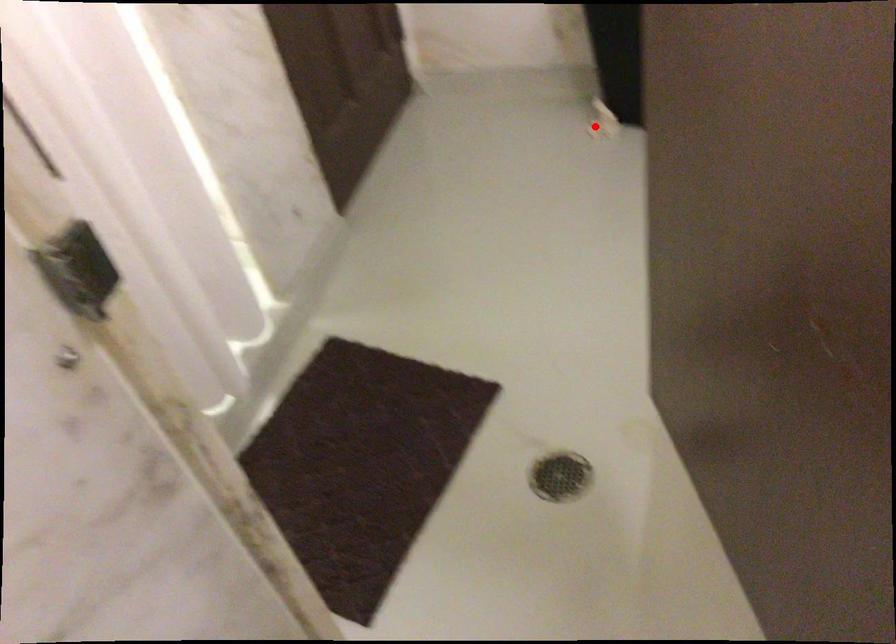
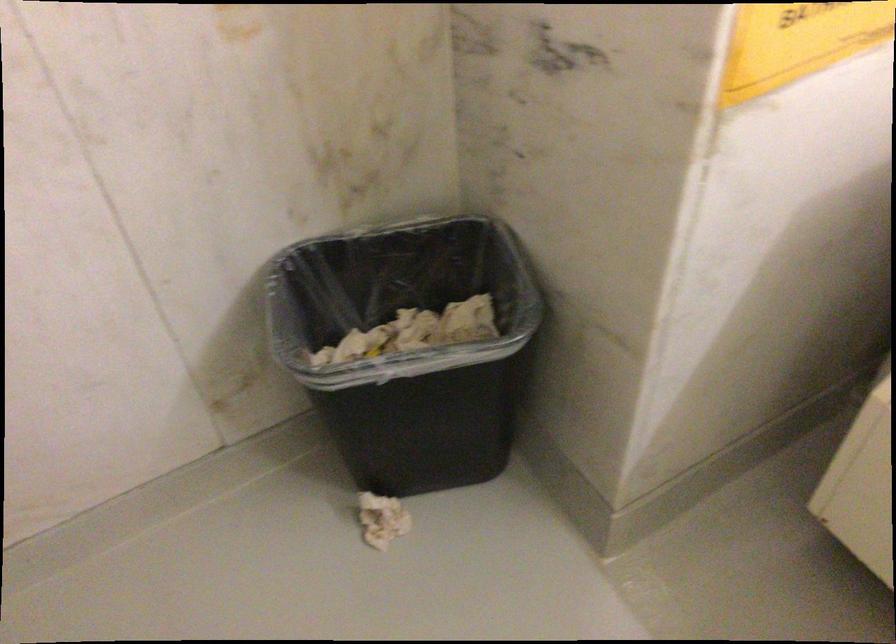
Question: I am providing you with two images of the same scene from different viewpoints. A red point is shown in image1. For the corresponding object point in image2, is it positioned nearer or farther from the camera?

Choices:
 (A) Nearer
 (B) Farther

Answer: (A)